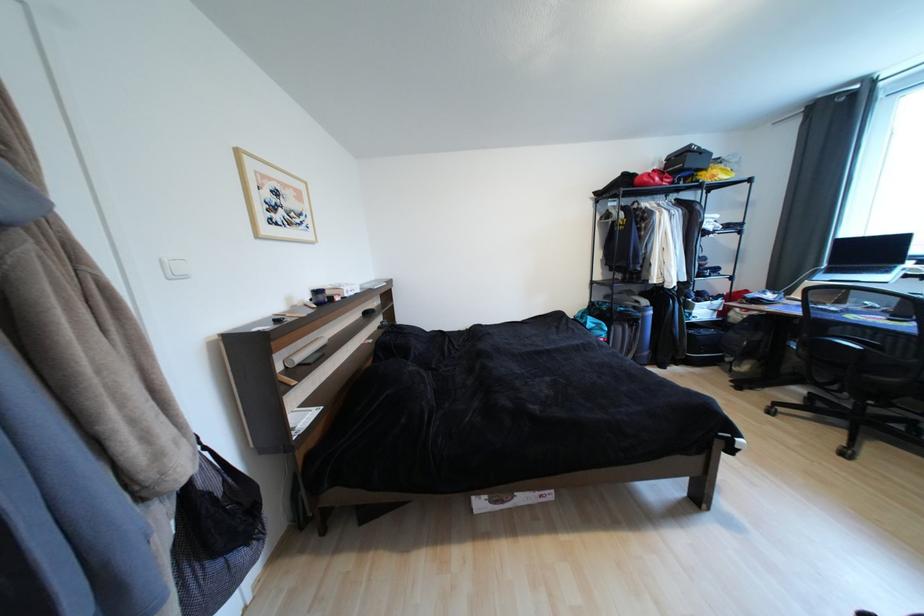
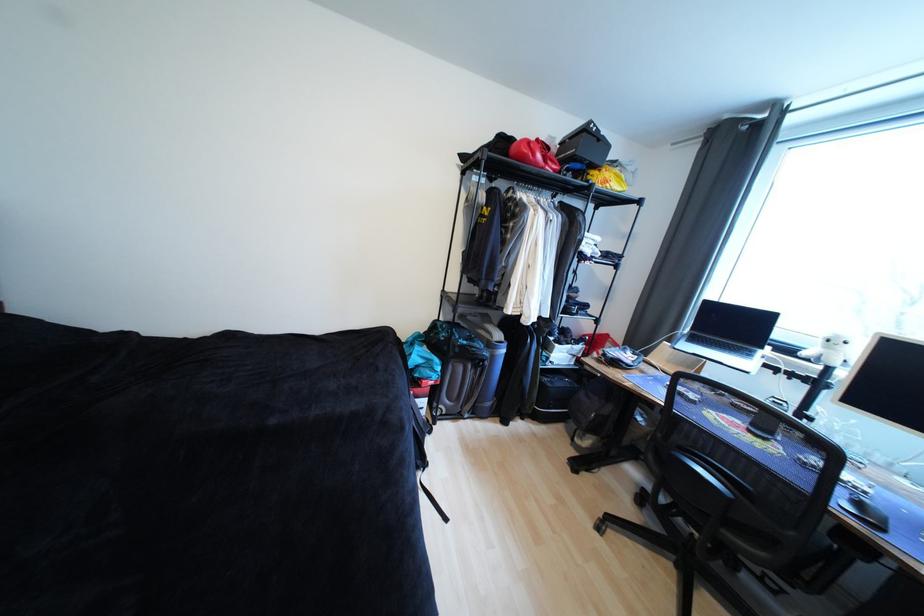
In a continuous first-person perspective shot, in which direction is the camera moving?

The cameraman walked toward right, forward.